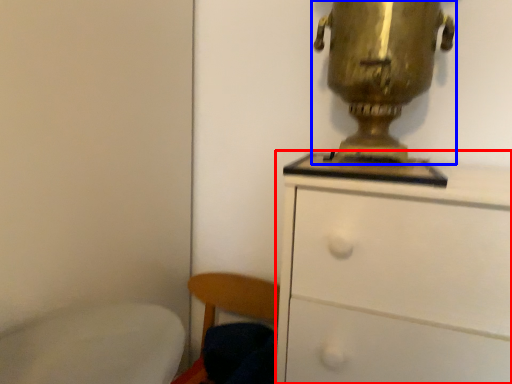
Question: Which object is further to the camera taking this photo, chest of drawers (highlighted by a red box) or table lamp (highlighted by a blue box)?

Choices:
 (A) chest of drawers
 (B) table lamp

Answer: (B)